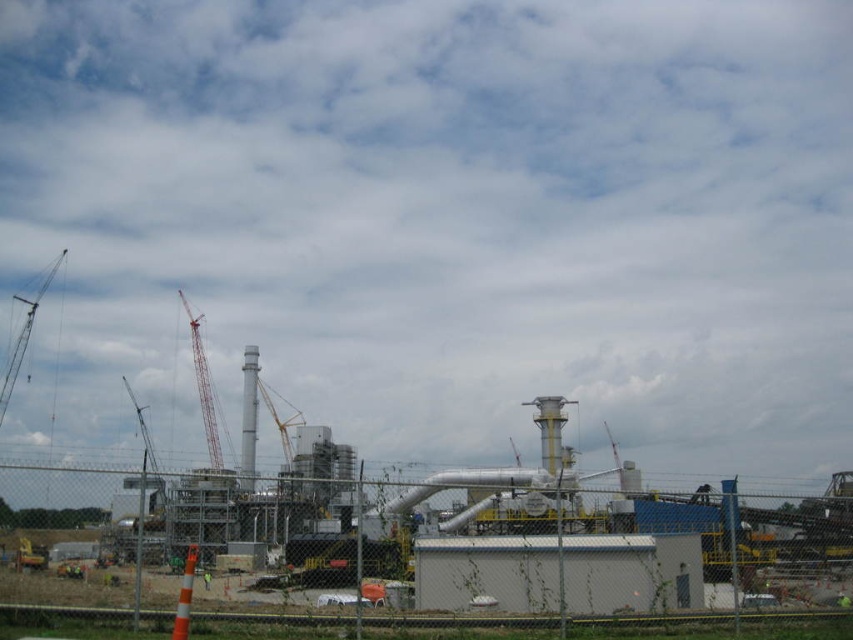
Question: Does white matte building at center lie behind metallic gray crane at left?

Choices:
 (A) no
 (B) yes

Answer: (A)

Question: Which object is closer to the camera taking this photo?

Choices:
 (A) metallic gray crane at left
 (B) white matte building at center

Answer: (B)

Question: Which point is farther to the camera?

Choices:
 (A) [194, 324]
 (B) [26, 344]
 (C) [136, 400]

Answer: (B)

Question: Which object appears farthest from the camera in this image?

Choices:
 (A) metallic gray crane at left
 (B) white matte building at center
 (C) metallic yellow crane at center
 (D) red painted metal crane at center

Answer: (C)

Question: Can you confirm if red painted metal crane at center is wider than metallic gray crane at upper left?

Choices:
 (A) no
 (B) yes

Answer: (A)

Question: Does red painted metal crane at center have a greater width compared to metallic gray crane at left?

Choices:
 (A) no
 (B) yes

Answer: (A)